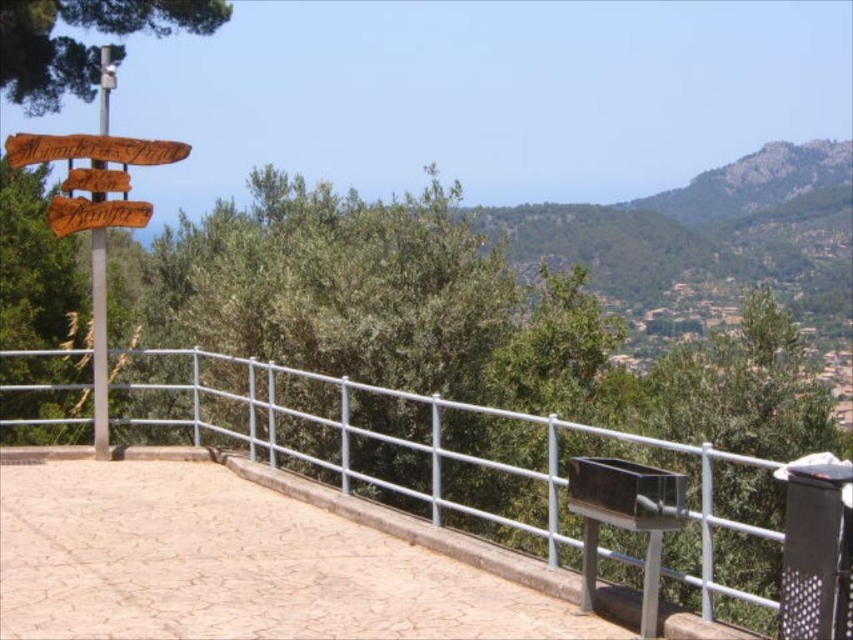
You are a painter setting up your easel to capture the scenic overlook. You want to ensure both the silver metallic fence at center and the green leafy tree at upper left are visible in your painting. Given their sizes, which object should you place closer to the center of your canvas to maintain balance?

The silver metallic fence at center is bigger than the green leafy tree at upper left, so to maintain balance in the painting, you should place the smaller green leafy tree at upper left closer to the center of the canvas.